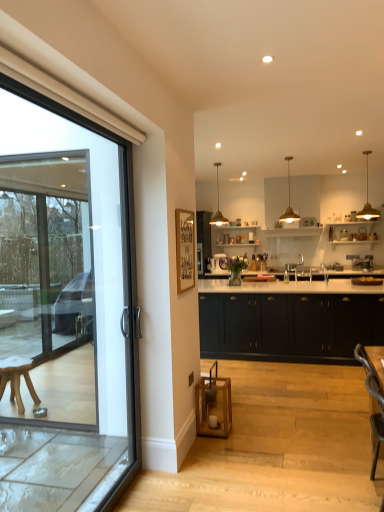
Question: Should I look upward or downward to see matte black cabinets at center?

Choices:
 (A) down
 (B) up

Answer: (A)

Question: Considering the relative sizes of wooden armchair at lower right and matte black cabinets at center in the image provided, is wooden armchair at lower right wider than matte black cabinets at center?

Choices:
 (A) no
 (B) yes

Answer: (A)

Question: Is wooden armchair at lower right behind matte black cabinets at center?

Choices:
 (A) no
 (B) yes

Answer: (A)

Question: Does wooden armchair at lower right have a lesser height compared to matte black cabinets at center?

Choices:
 (A) yes
 (B) no

Answer: (A)

Question: Could you tell me if wooden armchair at lower right is facing matte black cabinets at center?

Choices:
 (A) yes
 (B) no

Answer: (B)

Question: Is wooden armchair at lower right to the left of matte black cabinets at center from the viewer's perspective?

Choices:
 (A) no
 (B) yes

Answer: (B)

Question: Would you consider wooden armchair at lower right to be distant from matte black cabinets at center?

Choices:
 (A) no
 (B) yes

Answer: (B)

Question: Can you confirm if matte black cabinets at center is bigger than wooden armchair at lower right?

Choices:
 (A) no
 (B) yes

Answer: (B)

Question: Is matte black cabinets at center outside wooden armchair at lower right?

Choices:
 (A) yes
 (B) no

Answer: (A)

Question: Does matte black cabinets at center have a greater width compared to wooden armchair at lower right?

Choices:
 (A) no
 (B) yes

Answer: (B)

Question: Is matte black cabinets at center closer to the viewer compared to wooden armchair at lower right?

Choices:
 (A) yes
 (B) no

Answer: (B)

Question: Is matte black cabinets at center oriented towards wooden armchair at lower right?

Choices:
 (A) yes
 (B) no

Answer: (A)

Question: Is matte black cabinets at center oriented away from wooden armchair at lower right?

Choices:
 (A) yes
 (B) no

Answer: (B)

Question: Looking at their shapes, would you say matte black cabinets at center is wider or thinner than wooden armchair at lower right?

Choices:
 (A) thin
 (B) wide

Answer: (B)